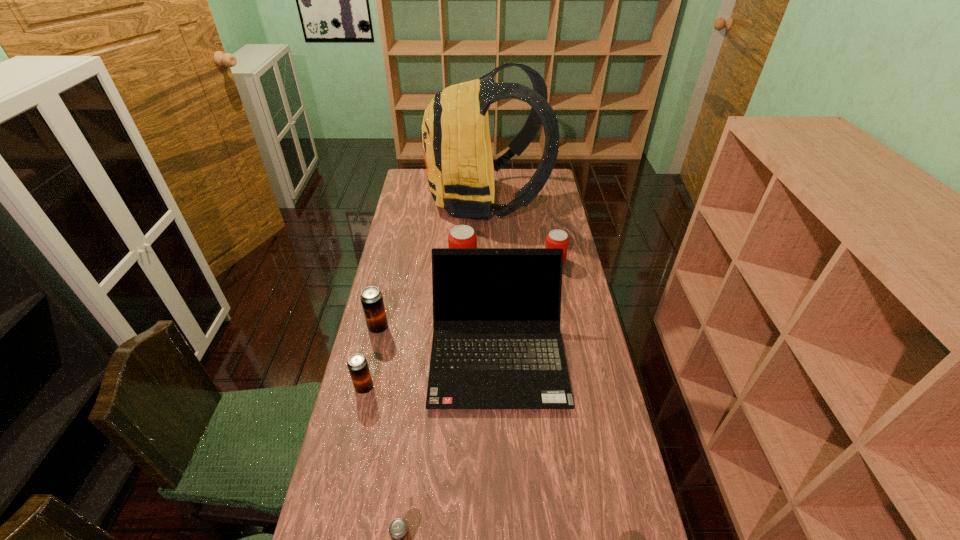
This screenshot has width=960, height=540. In order to click on the second smallest black beer can in this screenshot , I will do pos(357,364).

Locate an element on the screen. the fourth farthest beer can is located at coordinates (x=357, y=364).

Where is `vacant space situated 0.080m on the front-facing side of the farthest object`? vacant space situated 0.080m on the front-facing side of the farthest object is located at coordinates (411, 200).

I want to click on vacant area situated 0.130m on the front-facing side of the farthest object, so click(400, 200).

Locate an element on the screen. This screenshot has width=960, height=540. free location located on the screen of the sixth shortest object is located at coordinates (500, 433).

The width and height of the screenshot is (960, 540). Find the location of `blank space located 0.050m on the left of the bigger red beer can`. blank space located 0.050m on the left of the bigger red beer can is located at coordinates (437, 266).

The height and width of the screenshot is (540, 960). Find the location of `vacant space situated on the back of the farthest black beer can`. vacant space situated on the back of the farthest black beer can is located at coordinates (396, 249).

Image resolution: width=960 pixels, height=540 pixels. I want to click on free space located 0.350m on the left of the right red beer can, so click(455, 262).

At what (x,y) coordinates should I click in order to perform the action: click on free space located 0.090m on the back of the second farthest black beer can. Please return your answer as a coordinate pair (x, y). Looking at the image, I should click on (372, 356).

Locate an element on the screen. The image size is (960, 540). object at the far edge is located at coordinates (460, 168).